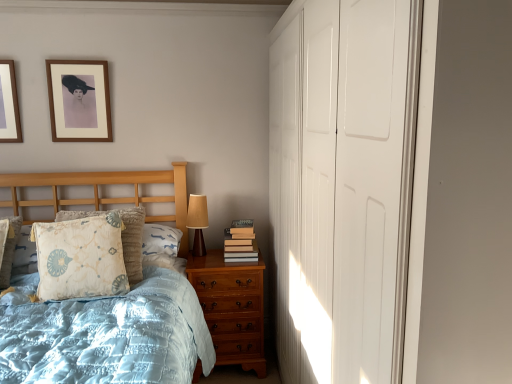
Identify the location of vacant area located to the right-hand side of matte brown wood table lamp at right. (214, 257).